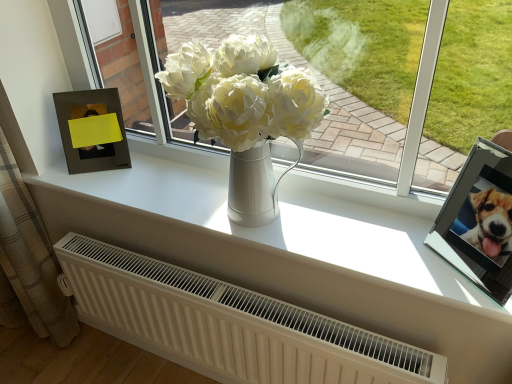
Question: Is matte brown picture frame at left, acting as the 1th picture frame starting from the left, not inside metallic silver picture frame at upper right, the 1th picture frame in the right-to-left sequence?

Choices:
 (A) no
 (B) yes

Answer: (B)

Question: Is matte brown picture frame at left, the 1th picture frame viewed from the back, taller than metallic silver picture frame at upper right, the 2th picture frame when ordered from left to right?

Choices:
 (A) yes
 (B) no

Answer: (A)

Question: From a real-world perspective, is matte brown picture frame at left, acting as the 1th picture frame starting from the left, positioned over metallic silver picture frame at upper right, the 2th picture frame viewed from the back, based on gravity?

Choices:
 (A) no
 (B) yes

Answer: (A)

Question: Is matte brown picture frame at left, positioned as the second picture frame in right-to-left order, further to camera compared to metallic silver picture frame at upper right, which is the 1th picture frame from front to back?

Choices:
 (A) no
 (B) yes

Answer: (B)

Question: Is there a large distance between matte brown picture frame at left, which is the second picture frame in front-to-back order, and metallic silver picture frame at upper right, the 2th picture frame viewed from the back?

Choices:
 (A) yes
 (B) no

Answer: (B)

Question: Considering the relative sizes of matte brown picture frame at left, acting as the 1th picture frame starting from the left, and metallic silver picture frame at upper right, which is the 1th picture frame from front to back, in the image provided, is matte brown picture frame at left, acting as the 1th picture frame starting from the left, wider than metallic silver picture frame at upper right, which is the 1th picture frame from front to back,?

Choices:
 (A) yes
 (B) no

Answer: (B)

Question: From the image's perspective, is matte brown picture frame at left, the 1th picture frame viewed from the back, below white matte radiator at lower center?

Choices:
 (A) no
 (B) yes

Answer: (A)

Question: Is matte brown picture frame at left, acting as the 1th picture frame starting from the left, directly adjacent to white matte radiator at lower center?

Choices:
 (A) yes
 (B) no

Answer: (B)

Question: Is matte brown picture frame at left, acting as the 1th picture frame starting from the left, behind white matte radiator at lower center?

Choices:
 (A) no
 (B) yes

Answer: (B)

Question: Is matte brown picture frame at left, the 1th picture frame viewed from the back, facing away from white matte radiator at lower center?

Choices:
 (A) no
 (B) yes

Answer: (A)

Question: Can you confirm if matte brown picture frame at left, positioned as the second picture frame in right-to-left order, is taller than white matte radiator at lower center?

Choices:
 (A) no
 (B) yes

Answer: (A)

Question: Considering the relative sizes of matte brown picture frame at left, acting as the 1th picture frame starting from the left, and white matte radiator at lower center in the image provided, is matte brown picture frame at left, acting as the 1th picture frame starting from the left, bigger than white matte radiator at lower center?

Choices:
 (A) no
 (B) yes

Answer: (A)

Question: Is metallic silver picture frame at upper right, the 1th picture frame in the right-to-left sequence, not within plaid fabric curtain at left?

Choices:
 (A) no
 (B) yes

Answer: (B)